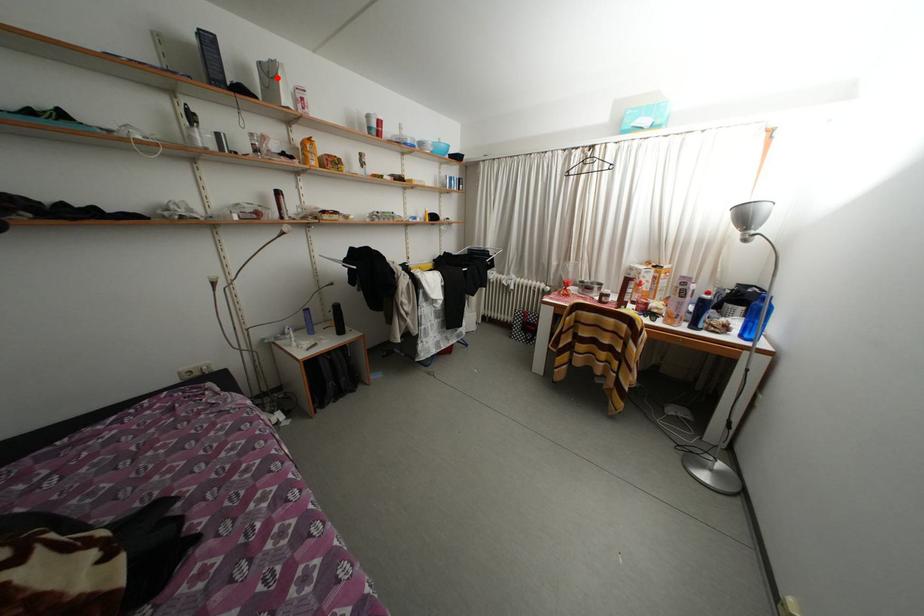
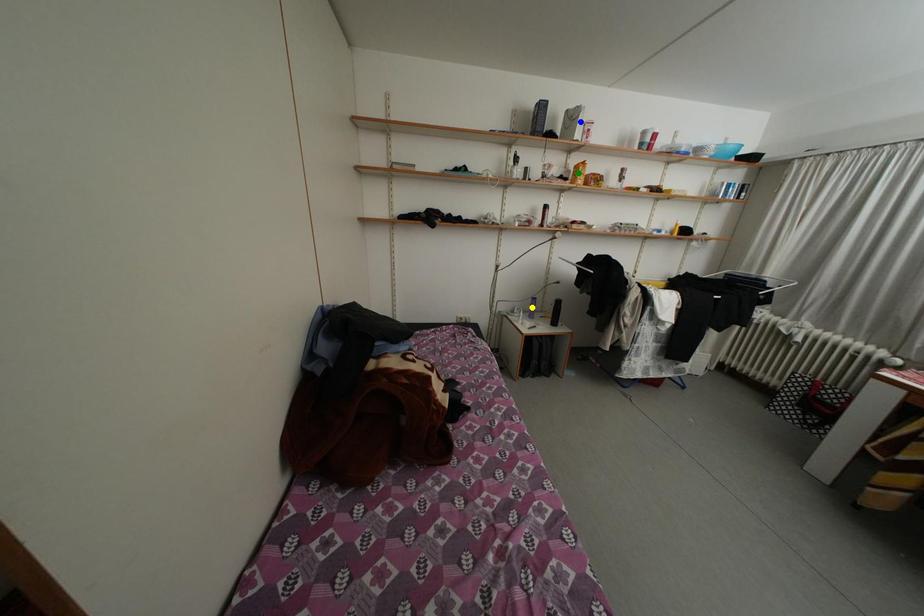
Question: I am providing you with two images of the same scene from different viewpoints. A red point is marked on the first image. You are given multiple points on the second image. Which point in image 2 is actually the same real-world point as the red point in image 1?

Choices:
 (A) yellow point
 (B) green point
 (C) blue point

Answer: (C)